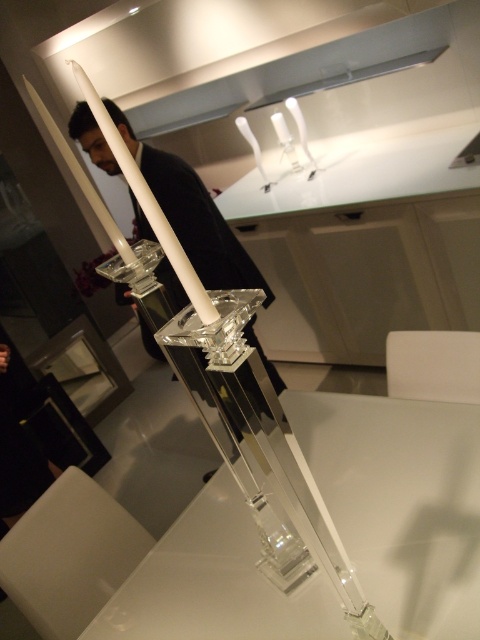
In the scene shown: You are a guest at a formal event and see the matte black suit at center and the white glossy exhaust hood at upper center. Which object is positioned lower in the scene?

The matte black suit at center is located below the white glossy exhaust hood at upper center, so it is positioned lower in the scene.

You are standing in the dining area and want to take a photo of the two points mentioned. Which point, point (168, 262) or point (276, 93), will appear larger in your camera view?

Point (168, 262) is closer to the camera than point (276, 93), so it will appear larger in the camera view.